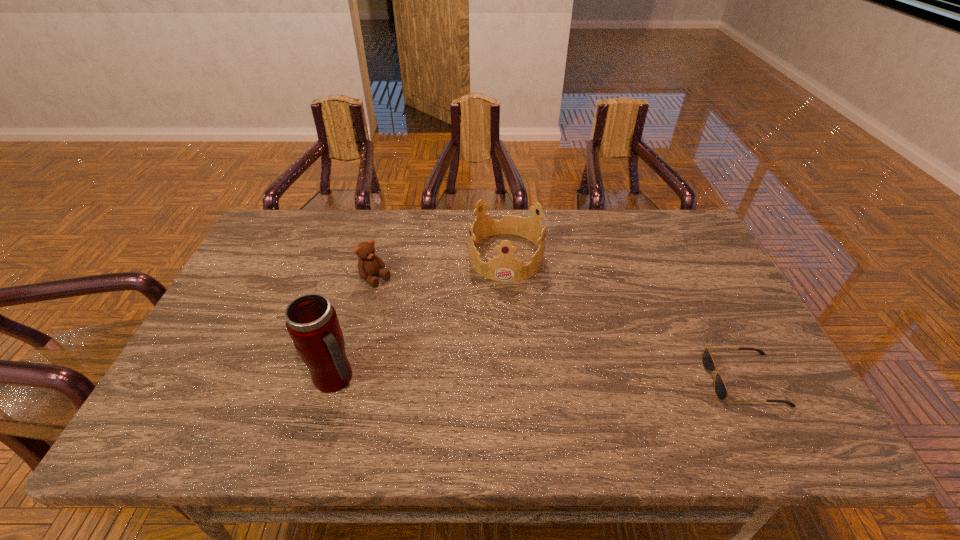
Find the location of a particular element. free space between the shortest object and the thermos bottle is located at coordinates (540, 379).

Where is `free space between the second shortest object and the sunglasses`? The width and height of the screenshot is (960, 540). free space between the second shortest object and the sunglasses is located at coordinates (560, 329).

The height and width of the screenshot is (540, 960). In order to click on vacant area that lies between the second shortest object and the shortest object in this screenshot , I will do `click(560, 329)`.

The image size is (960, 540). I want to click on free space between the thermos bottle and the teddy bear, so click(356, 329).

Where is `unoccupied area between the teddy bear and the second object from right to left`? The width and height of the screenshot is (960, 540). unoccupied area between the teddy bear and the second object from right to left is located at coordinates (441, 268).

Locate an element on the screen. vacant point located between the thermos bottle and the sunglasses is located at coordinates (540, 379).

This screenshot has height=540, width=960. I want to click on unoccupied area between the thermos bottle and the teddy bear, so click(356, 329).

Locate which object is the third closest to the second object from right to left. Please provide its 2D coordinates. Your answer should be formatted as a tuple, i.e. [(x, y)], where the tuple contains the x and y coordinates of a point satisfying the conditions above.

[(708, 363)]

Identify which object is the nearest to the shortest object. Please provide its 2D coordinates. Your answer should be formatted as a tuple, i.e. [(x, y)], where the tuple contains the x and y coordinates of a point satisfying the conditions above.

[(504, 268)]